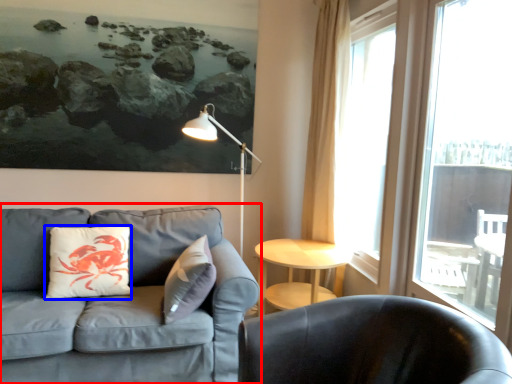
Question: Which of the following is the closest to the observer, studio couch (highlighted by a red box) or pillow (highlighted by a blue box)?

Choices:
 (A) studio couch
 (B) pillow

Answer: (A)